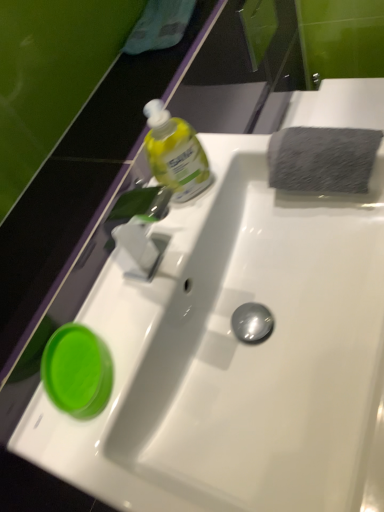
Image resolution: width=384 pixels, height=512 pixels. I want to click on empty space that is in between green glossy cup at lower left and translucent yellow liquid at upper center, so click(x=146, y=277).